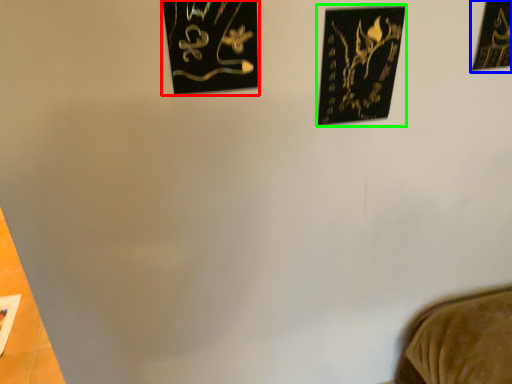
Question: Estimate the real-world distances between objects in this image. Which object is farther from picture frame (highlighted by a red box), picture frame (highlighted by a blue box) or picture frame (highlighted by a green box)?

Choices:
 (A) picture frame
 (B) picture frame

Answer: (A)